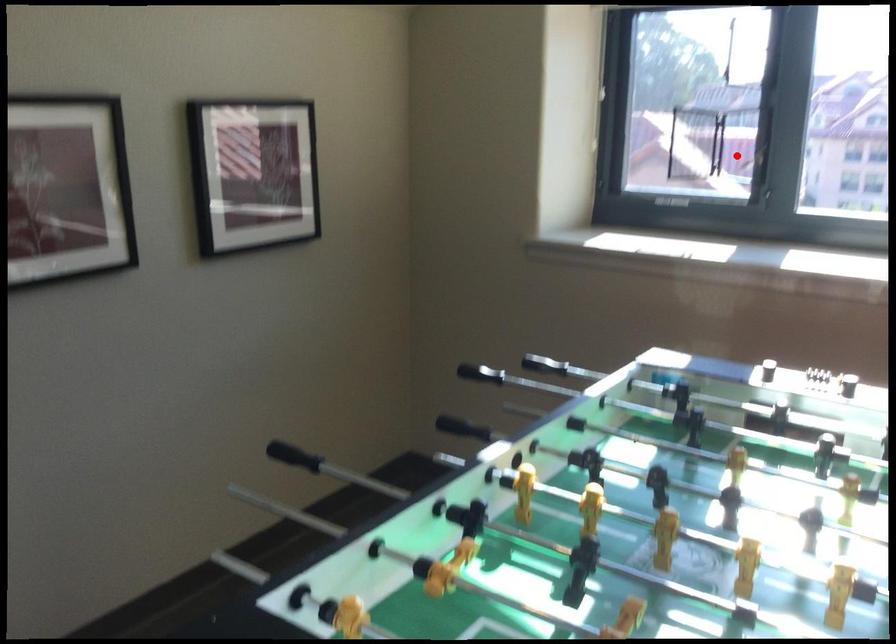
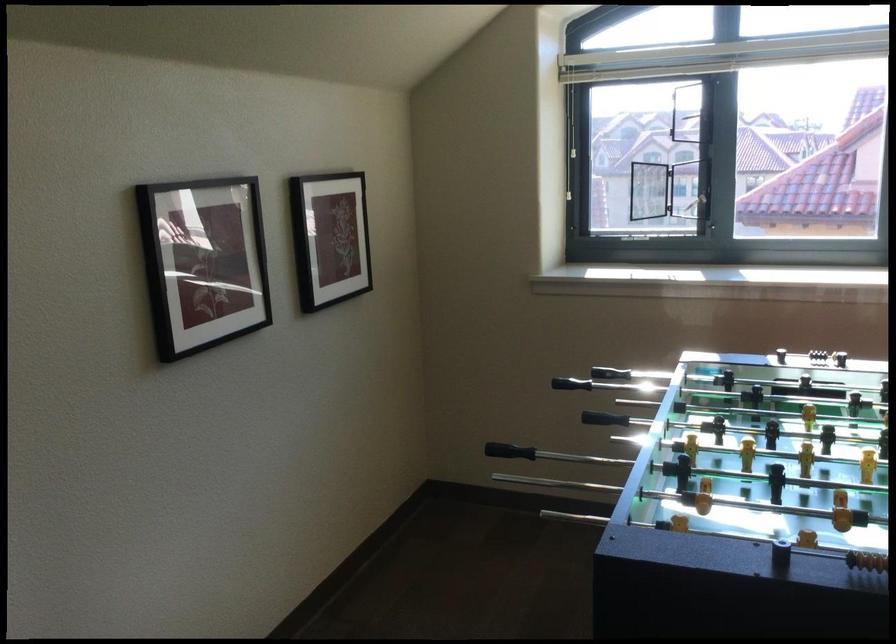
Question: I am providing you with two images of the same scene from different viewpoints. In image1, a red point is highlighted. Considering the same 3D point in image2, which of the following is correct?

Choices:
 (A) It is closer
 (B) It is farther

Answer: (B)